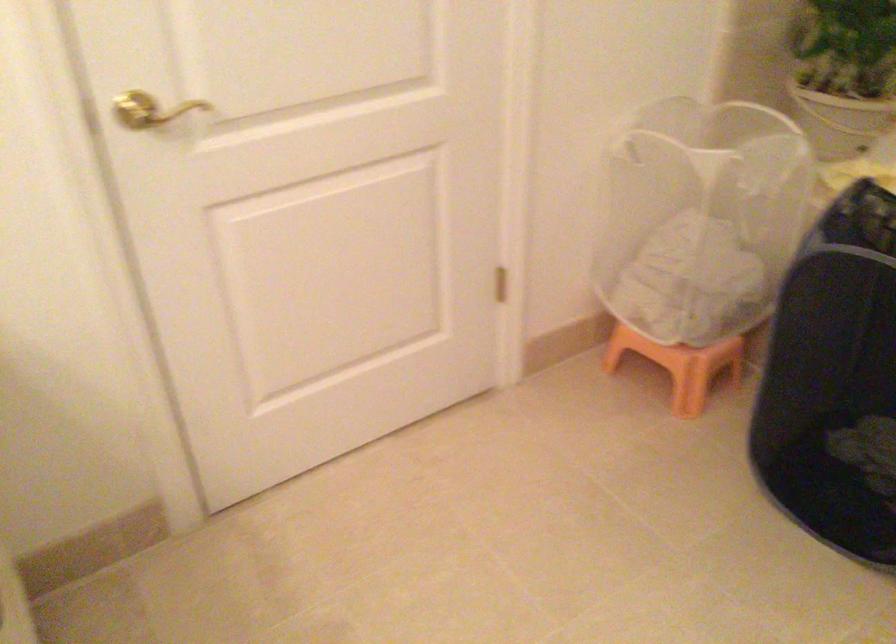
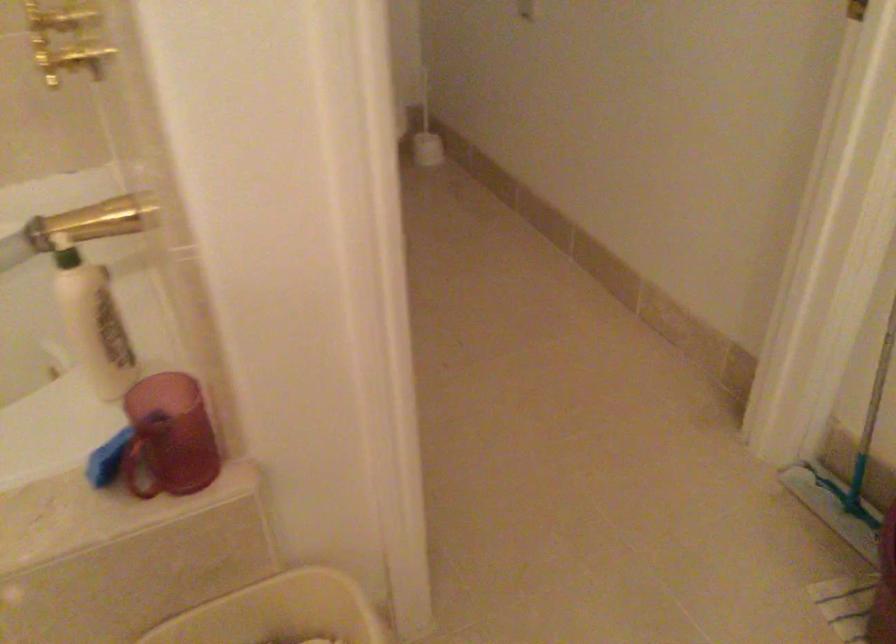
First-person continuous shooting, in which direction is the camera rotating?

The rotation direction of the camera is right-down.